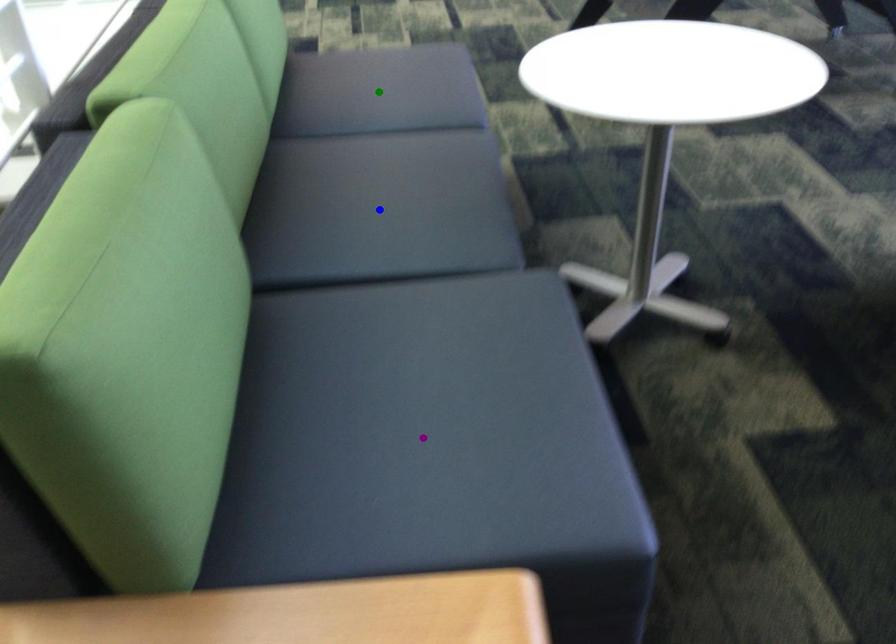
Order these from farthest to nearest:
green point | purple point | blue point

green point < blue point < purple point